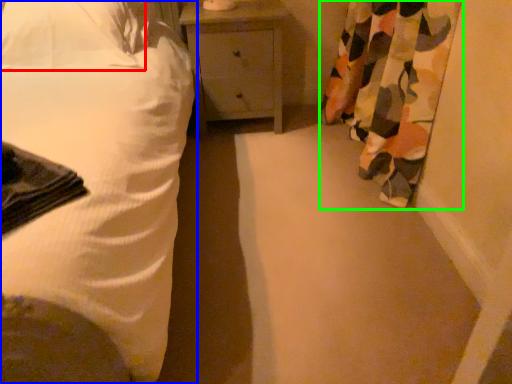
Question: Which is nearer to the pillow (highlighted by a red box)? bed (highlighted by a blue box) or curtain (highlighted by a green box).

Choices:
 (A) bed
 (B) curtain

Answer: (A)